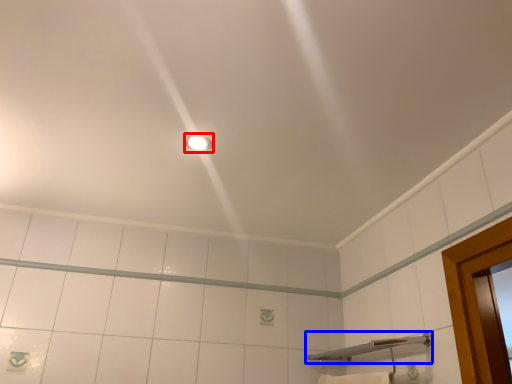
Question: Among these objects, which one is farthest to the camera, light fixture (highlighted by a red box) or shower (highlighted by a blue box)?

Choices:
 (A) light fixture
 (B) shower

Answer: (A)